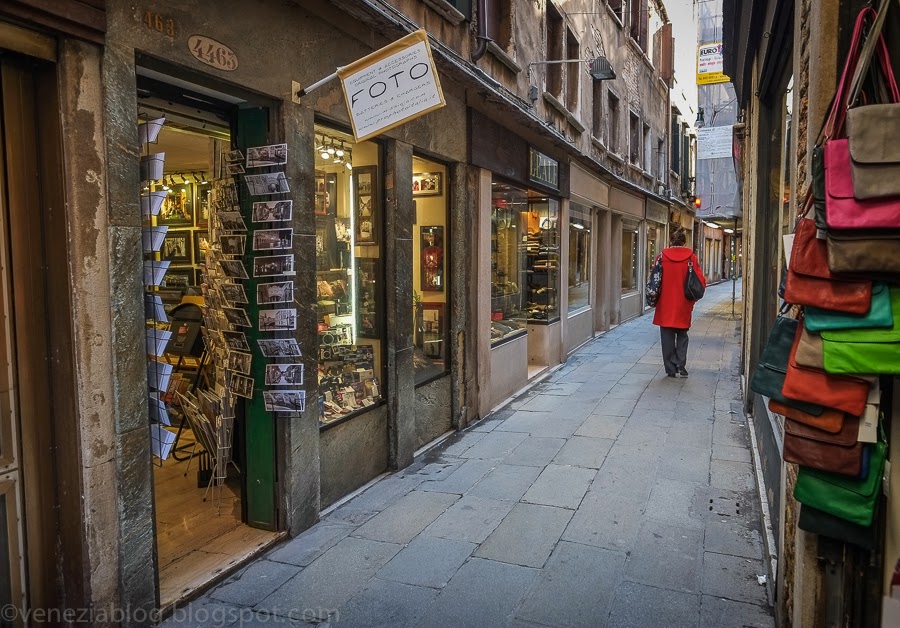
Identify the location of wall. (297, 473).